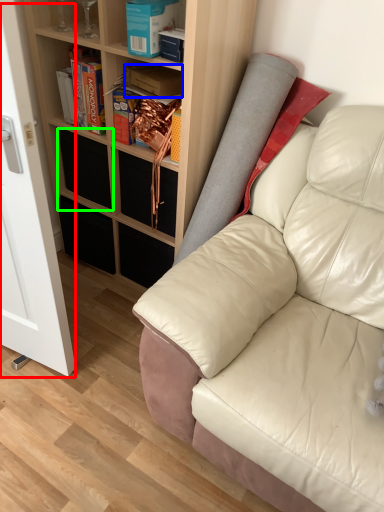
Question: Based on their relative distances, which object is nearer to glass door (highlighted by a red box)? Choose from book (highlighted by a blue box) and drawer (highlighted by a green box).

Choices:
 (A) book
 (B) drawer

Answer: (B)